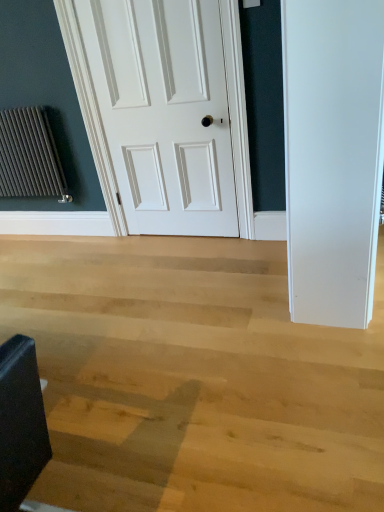
Question: Is white matte door at center positioned in front of dark gray textured radiator at left?

Choices:
 (A) no
 (B) yes

Answer: (B)

Question: Is white matte door at center placed right next to dark gray textured radiator at left?

Choices:
 (A) no
 (B) yes

Answer: (A)

Question: Can you confirm if white matte door at center is shorter than dark gray textured radiator at left?

Choices:
 (A) yes
 (B) no

Answer: (B)

Question: Is white matte door at center not within dark gray textured radiator at left?

Choices:
 (A) no
 (B) yes

Answer: (B)

Question: Is white matte door at center positioned with its back to dark gray textured radiator at left?

Choices:
 (A) yes
 (B) no

Answer: (B)

Question: Considering the relative sizes of white matte door at center and dark gray textured radiator at left in the image provided, is white matte door at center taller than dark gray textured radiator at left?

Choices:
 (A) yes
 (B) no

Answer: (A)

Question: Would you say dark gray textured radiator at left is outside white matte door at center?

Choices:
 (A) no
 (B) yes

Answer: (B)

Question: Considering the relative sizes of dark gray textured radiator at left and white matte door at center in the image provided, is dark gray textured radiator at left bigger than white matte door at center?

Choices:
 (A) yes
 (B) no

Answer: (B)

Question: Considering the relative sizes of dark gray textured radiator at left and white matte door at center in the image provided, is dark gray textured radiator at left smaller than white matte door at center?

Choices:
 (A) yes
 (B) no

Answer: (A)

Question: Is dark gray textured radiator at left placed right next to white matte door at center?

Choices:
 (A) yes
 (B) no

Answer: (B)

Question: Considering the relative sizes of dark gray textured radiator at left and white matte door at center in the image provided, is dark gray textured radiator at left wider than white matte door at center?

Choices:
 (A) yes
 (B) no

Answer: (A)

Question: From a real-world perspective, is dark gray textured radiator at left below white matte door at center?

Choices:
 (A) no
 (B) yes

Answer: (B)

Question: Is dark gray textured radiator at left taller or shorter than white matte door at center?

Choices:
 (A) short
 (B) tall

Answer: (A)